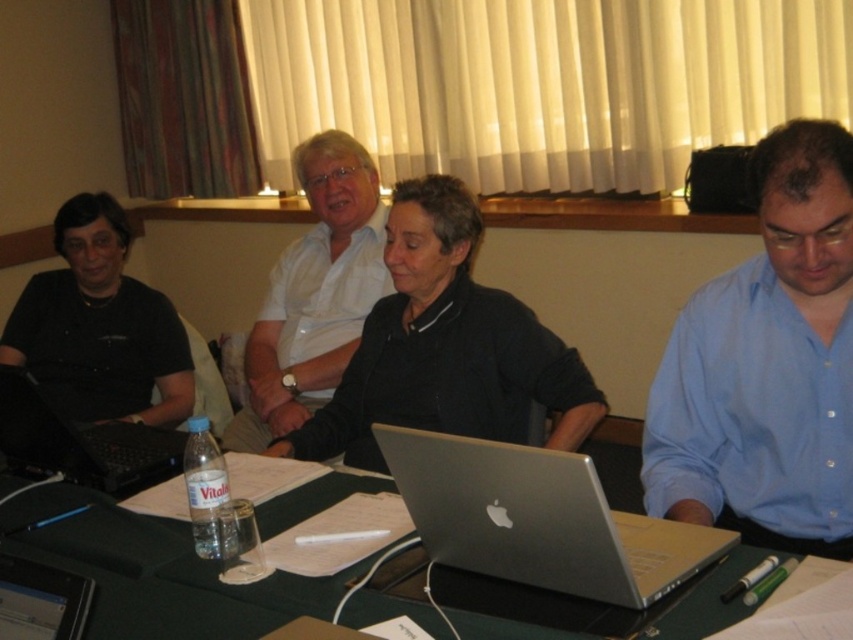
Is blue shirt at right above silver metallic tablet at lower left?

Indeed, blue shirt at right is positioned over silver metallic tablet at lower left.

Find the location of a particular element. blue shirt at right is located at coordinates (767, 365).

Is point (744, 509) closer to viewer compared to point (18, 596)?

No, it is not.

Image resolution: width=853 pixels, height=640 pixels. Find the location of `blue shirt at right`. blue shirt at right is located at coordinates (767, 365).

Is green matte table at center taller than white glossy shirt at center?

Incorrect, green matte table at center's height is not larger of white glossy shirt at center's.

Which of these two, green matte table at center or white glossy shirt at center, stands taller?

With more height is white glossy shirt at center.

Where is `green matte table at center`? This screenshot has height=640, width=853. green matte table at center is located at coordinates (155, 572).

Identify the location of green matte table at center. (155, 572).

Between point (447, 314) and point (175, 369), which one is positioned in front?

Point (447, 314) is more forward.

Identify the location of white matte shirt at center. The width and height of the screenshot is (853, 640). (445, 348).